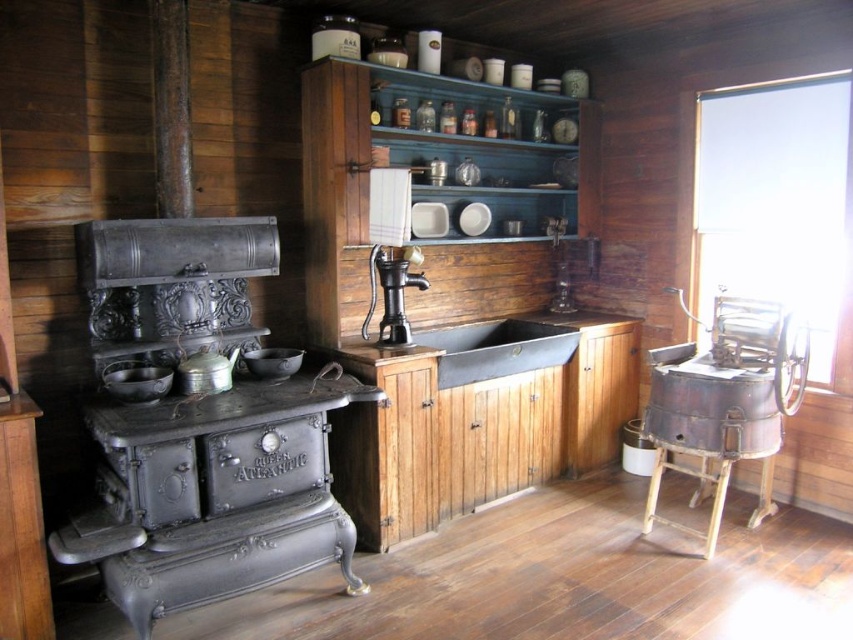
Question: Considering the relative positions of polished brass faucet at center and shiny metallic bowl at center in the image provided, where is polished brass faucet at center located with respect to shiny metallic bowl at center?

Choices:
 (A) below
 (B) above

Answer: (B)

Question: Does matte black pot at left lie behind shiny metallic bowl at center?

Choices:
 (A) yes
 (B) no

Answer: (B)

Question: Which point is farther to the camera?

Choices:
 (A) (120, 387)
 (B) (461, 362)
 (C) (283, 362)
 (D) (392, 289)

Answer: (B)

Question: Considering the relative positions of black cast iron sink at center and matte black pot at left in the image provided, where is black cast iron sink at center located with respect to matte black pot at left?

Choices:
 (A) left
 (B) right

Answer: (B)

Question: Estimate the real-world distances between objects in this image. Which object is closer to the matte black pot at left?

Choices:
 (A) shiny metallic bowl at center
 (B) black cast iron sink at center
 (C) polished brass faucet at center

Answer: (A)

Question: Which point is farther to the camera?

Choices:
 (A) matte black pot at left
 (B) polished brass faucet at center
 (C) shiny metallic bowl at center
 (D) black cast iron sink at center

Answer: (D)